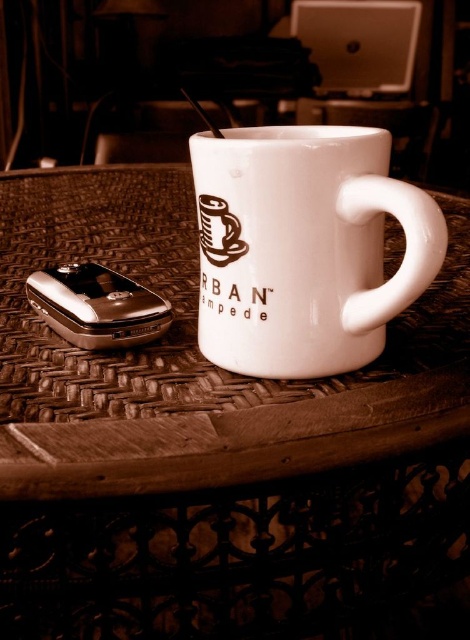
Question: Which object is the closest to the metallic silver phone at lower left?

Choices:
 (A) white wicker table at center
 (B) white glossy mug at center

Answer: (B)

Question: Which is nearer to the white wicker table at center?

Choices:
 (A) metallic silver phone at lower left
 (B) white glossy mug at center

Answer: (B)

Question: Can you confirm if white wicker table at center is positioned to the right of white glossy mug at center?

Choices:
 (A) yes
 (B) no

Answer: (B)

Question: Can you confirm if white wicker table at center is positioned to the left of white glossy mug at center?

Choices:
 (A) no
 (B) yes

Answer: (B)

Question: Which point is farther from the camera taking this photo?

Choices:
 (A) (33, 301)
 (B) (394, 200)

Answer: (A)

Question: From the image, what is the correct spatial relationship of white wicker table at center in relation to white glossy mug at center?

Choices:
 (A) right
 (B) left

Answer: (B)